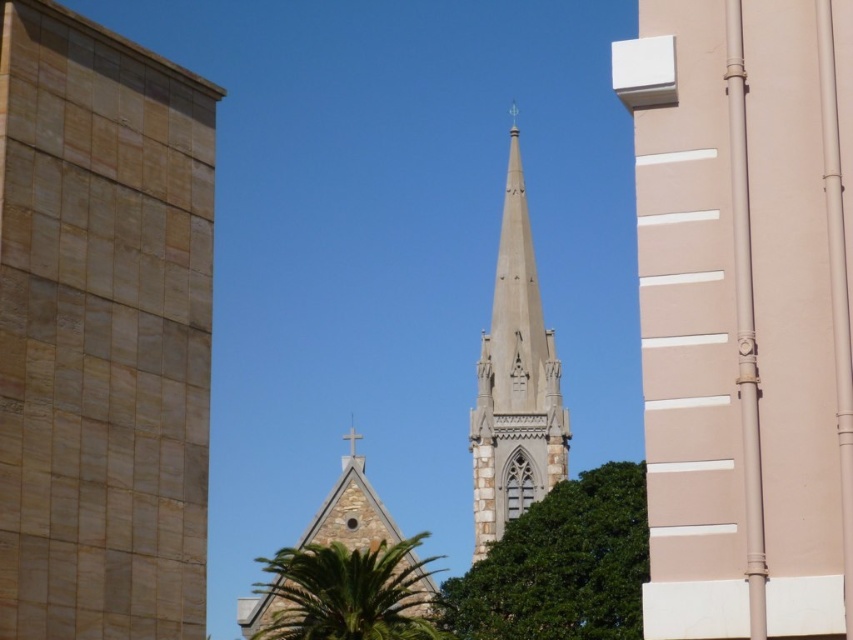
Question: Among these points, which one is farthest from the camera?

Choices:
 (A) (427, 577)
 (B) (502, 509)
 (C) (741, 58)

Answer: (B)

Question: Does green leafy tree at center have a smaller size compared to white stone spire at center?

Choices:
 (A) no
 (B) yes

Answer: (B)

Question: Is beige stone tower at center wider than stone steeple at center?

Choices:
 (A) yes
 (B) no

Answer: (B)

Question: Does green leafy palm tree at center have a larger size compared to stone steeple at center?

Choices:
 (A) no
 (B) yes

Answer: (A)

Question: Estimate the real-world distances between objects in this image. Which object is farther from the beige stone tower at center?

Choices:
 (A) green leafy palm tree at center
 (B) smooth beige pipe at center-right

Answer: (A)

Question: Based on their relative distances, which object is farther from the white stone spire at center?

Choices:
 (A) stone steeple at center
 (B) green leafy tree at center
 (C) green leafy palm tree at center
 (D) beige stone tower at center

Answer: (D)